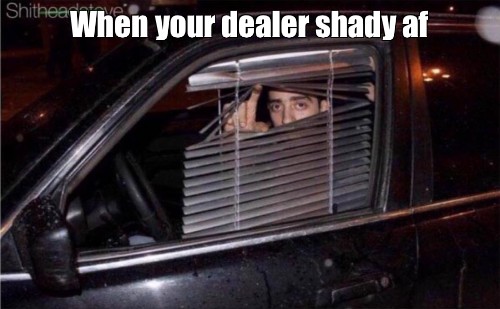
Identify the location of light circle top right. This screenshot has width=500, height=309. (489, 22).